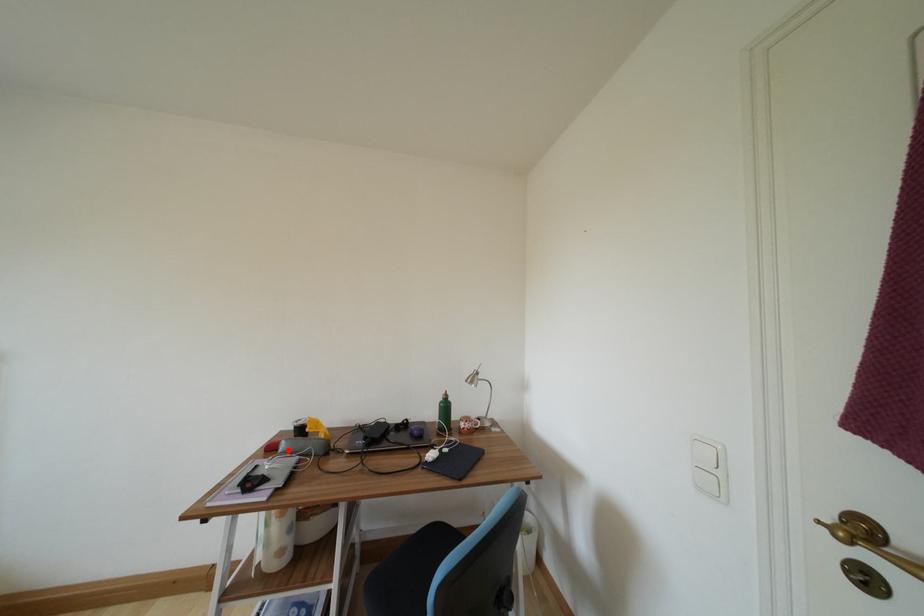
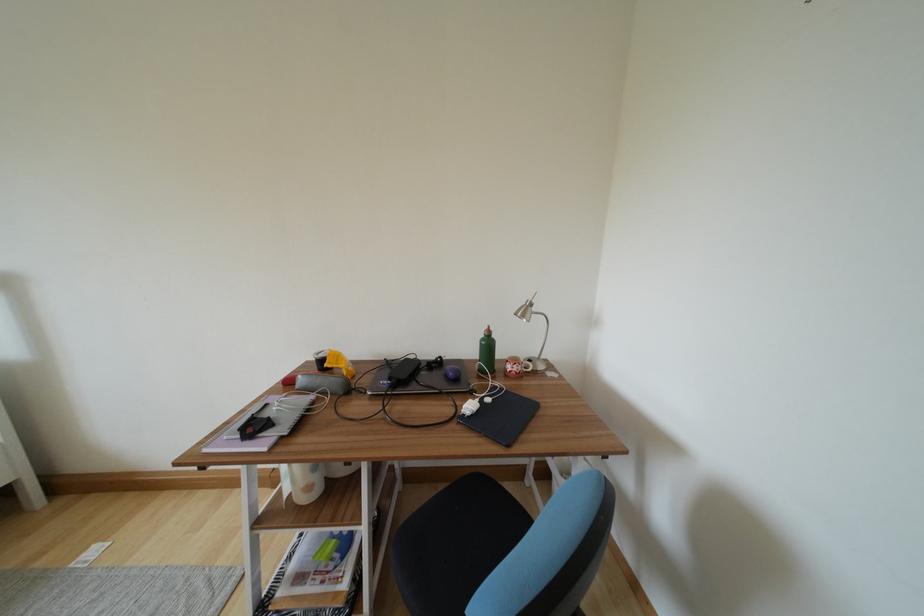
In the second image, find the point that corresponds to the highlighted location in the first image.

(306, 385)